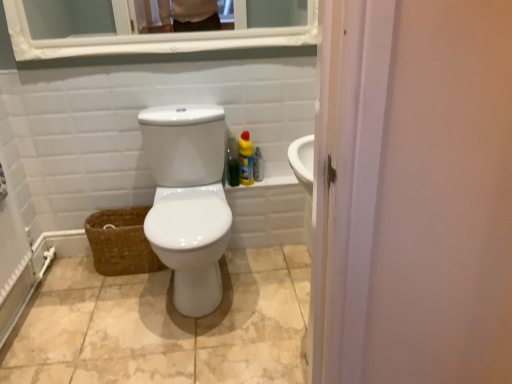
Question: From a real-world perspective, is brown woven basket at lower left physically located above or below clear plastic spray bottle at right, which appears as the second cleaning product when viewed from the left?

Choices:
 (A) above
 (B) below

Answer: (B)

Question: Is brown woven basket at lower left inside the boundaries of clear plastic spray bottle at right, the 1th cleaning product when ordered from right to left, or outside?

Choices:
 (A) inside
 (B) outside

Answer: (B)

Question: Estimate the real-world distances between objects in this image. Which object is farther from the beige ceramic tile at center?

Choices:
 (A) white glossy medicine cabinet at upper center
 (B) white glossy toilet at center
 (C) yellow matte bottle at right, the second cleaning product from the right
 (D) brown woven basket at lower left
 (E) clear plastic spray bottle at right, the 1th cleaning product when ordered from right to left

Answer: (A)

Question: Which object is the farthest from the beige ceramic tile at center?

Choices:
 (A) brown woven basket at lower left
 (B) white glossy medicine cabinet at upper center
 (C) clear plastic spray bottle at right, the 1th cleaning product when ordered from right to left
 (D) yellow matte bottle at right, the second cleaning product from the right
 (E) white glossy toilet at center

Answer: (B)